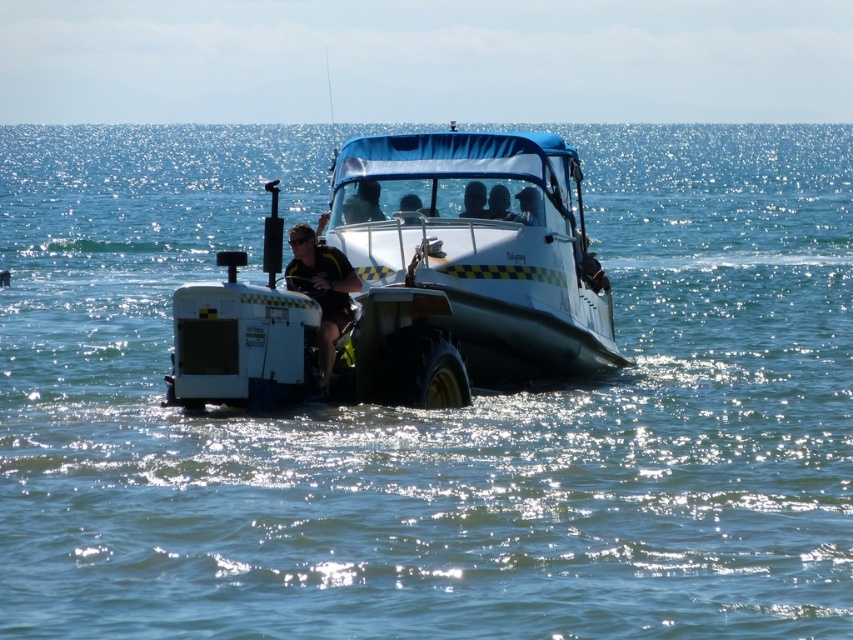
Where is `white rubber boat at center`? white rubber boat at center is located at coordinates (407, 285).

Identify the location of white rubber boat at center. Image resolution: width=853 pixels, height=640 pixels. (407, 285).

Is matte black helmet at center thinner than smooth skin face at center?

No.

Does matte black helmet at center appear under smooth skin face at center?

Yes, matte black helmet at center is below smooth skin face at center.

Who is more forward, (370,182) or (479,211)?

Point (479,211) is in front.

Where is `matte black helmet at center`? Image resolution: width=853 pixels, height=640 pixels. matte black helmet at center is located at coordinates (363, 204).

Who is higher up, yellow fabric life vest at center or smooth skin face at center?

smooth skin face at center

You are a GUI agent. You are given a task and a screenshot of the screen. Output one action in this format:
    pyautogui.click(x=<x>, y=<y>)
    Task: Click on the yellow fabric life vest at center
    The height and width of the screenshot is (640, 853).
    Given the screenshot: What is the action you would take?
    pyautogui.click(x=322, y=289)

Locate an element on the screen. The width and height of the screenshot is (853, 640). yellow fabric life vest at center is located at coordinates (322, 289).